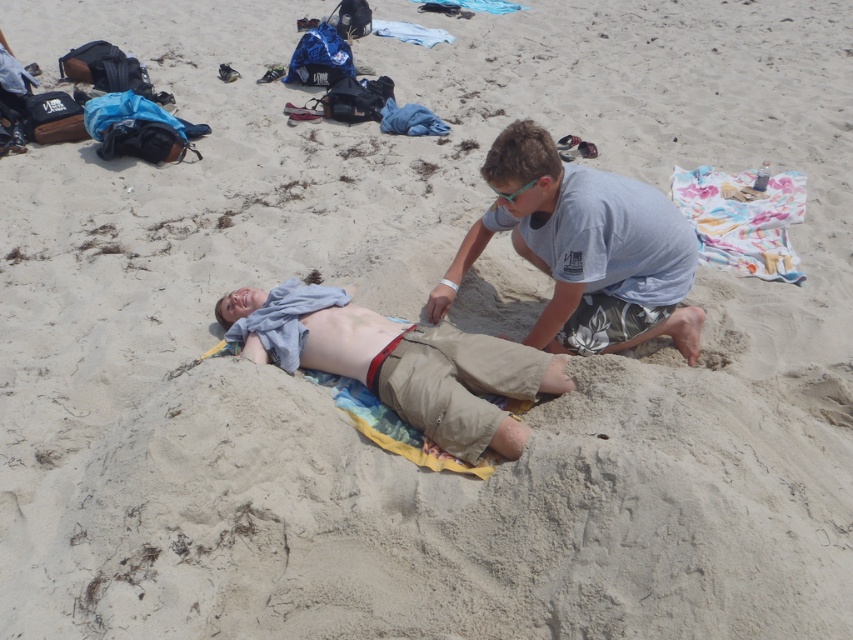
Is point (450, 436) behind point (720, 253)?

No.

Consider the image. Who is lower down, beige cotton shorts at center or multicolored fabric towel at upper center?

beige cotton shorts at center is lower down.

Is point (242, 330) positioned in front of point (772, 202)?

Yes.

Find the location of a particular element. beige cotton shorts at center is located at coordinates (399, 362).

Can you confirm if gray cotton shirt at center is bigger than multicolored fabric towel at upper center?

No, gray cotton shirt at center is not bigger than multicolored fabric towel at upper center.

Does gray cotton shirt at center lie in front of multicolored fabric towel at upper center?

Yes, gray cotton shirt at center is in front of multicolored fabric towel at upper center.

Between point (498, 160) and point (726, 180), which one is positioned in front?

Positioned in front is point (498, 160).

At what (x,y) coordinates should I click in order to perform the action: click on gray cotton shirt at center. Please return your answer as a coordinate pair (x, y). Looking at the image, I should click on pyautogui.click(x=585, y=250).

Can you confirm if gray cotton shirt at center is shorter than green plastic goggles at upper center?

No, gray cotton shirt at center is not shorter than green plastic goggles at upper center.

Does point (654, 310) come closer to viewer compared to point (512, 198)?

No.

Find the location of `gray cotton shirt at center`. gray cotton shirt at center is located at coordinates (585, 250).